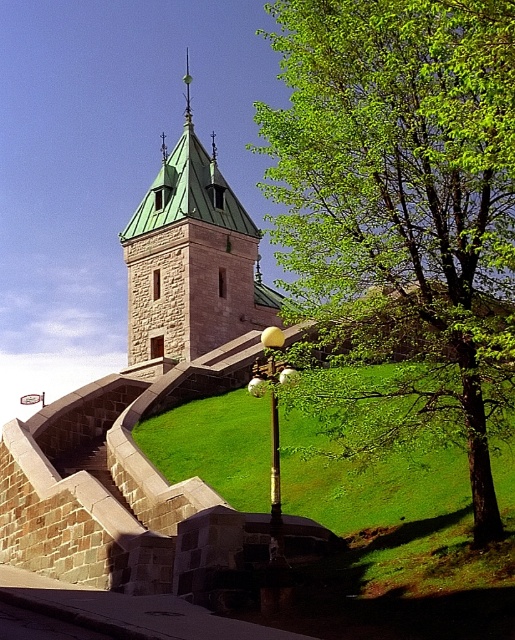
Does green leafy tree at right appear over green grass at center?

Correct, green leafy tree at right is located above green grass at center.

The image size is (515, 640). I want to click on green leafy tree at right, so click(403, 209).

Which of these two, green leafy tree at right or green stone tower at center, stands taller?

Standing taller between the two is green leafy tree at right.

Who is more distant from viewer, (512, 90) or (147, 236)?

Positioned behind is point (147, 236).

Describe the element at coordinates (403, 209) in the screenshot. I see `green leafy tree at right` at that location.

Identify the location of green leafy tree at right. This screenshot has width=515, height=640. (403, 209).

Is point (337, 509) closer to camera compared to point (218, 278)?

Yes, point (337, 509) is closer to viewer.

Can you confirm if green grass at center is thinner than green stone tower at center?

No.

Between point (289, 509) and point (239, 273), which one is positioned in front?

Positioned in front is point (289, 509).

Locate an element on the screen. The width and height of the screenshot is (515, 640). green grass at center is located at coordinates (368, 480).